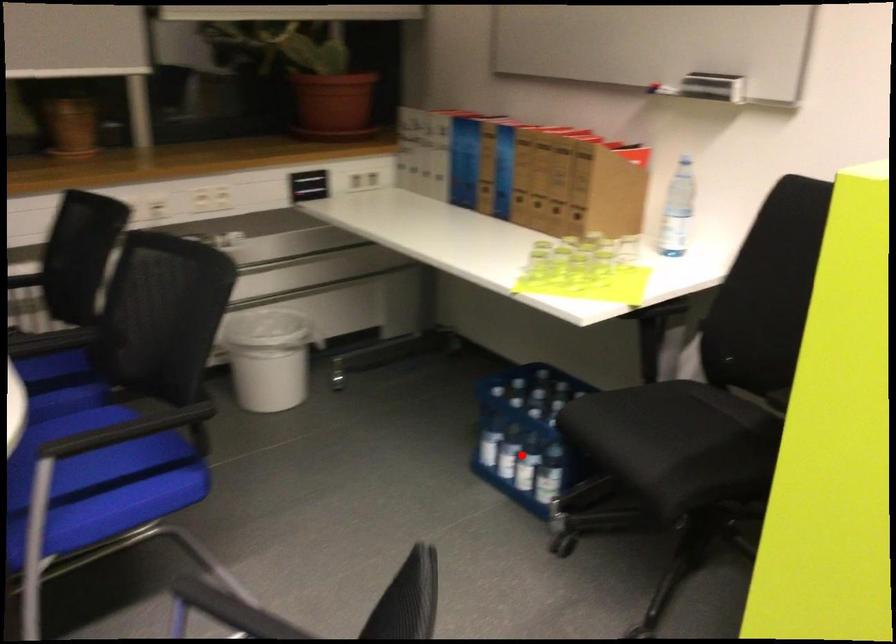
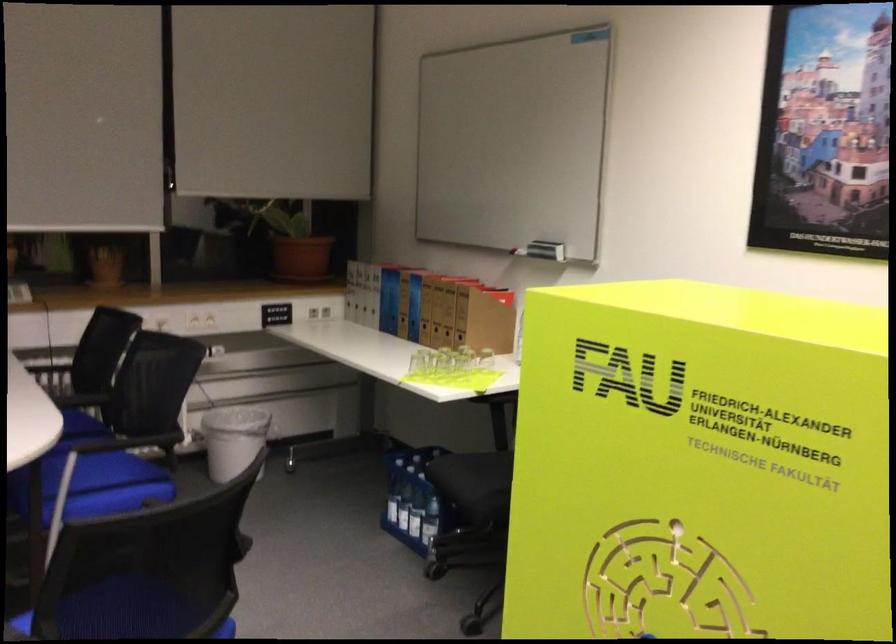
Question: I am providing you with two images of the same scene from different viewpoints. Given a red point in image1, look at the same physical point in image2. Is it:

Choices:
 (A) Closer to the viewpoint
 (B) Farther from the viewpoint

Answer: (B)